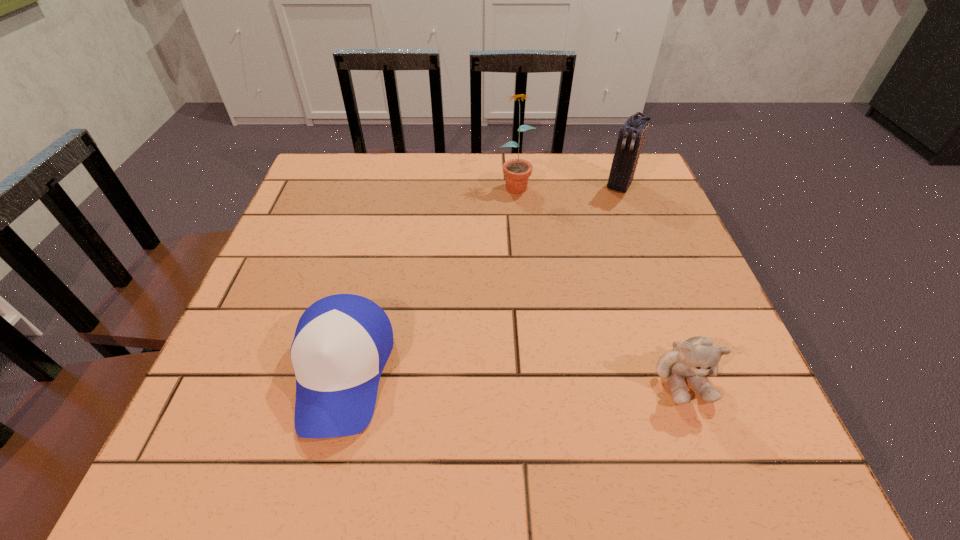
Locate an element on the screen. This screenshot has width=960, height=540. vacant space located 0.070m with the zip open on the second tallest object is located at coordinates (606, 209).

At what (x,y) coordinates should I click in order to perform the action: click on sunflower present at the far edge. Please return your answer as a coordinate pair (x, y). This screenshot has width=960, height=540. Looking at the image, I should click on (517, 171).

The image size is (960, 540). In order to click on clutch bag that is at the far edge in this screenshot , I will do `click(631, 136)`.

Where is `baseball cap at the near edge`? baseball cap at the near edge is located at coordinates (342, 342).

Find the location of a particular element. Image resolution: width=960 pixels, height=540 pixels. teddy bear that is at the near edge is located at coordinates tap(696, 357).

The width and height of the screenshot is (960, 540). Find the location of `object located in the left edge section of the desktop`. object located in the left edge section of the desktop is located at coordinates (342, 342).

Find the location of a particular element. Image resolution: width=960 pixels, height=540 pixels. teddy bear present at the right edge is located at coordinates (696, 357).

What are the coordinates of `clutch bag positioned at the right edge` in the screenshot? It's located at (631, 136).

Image resolution: width=960 pixels, height=540 pixels. Find the location of `object at the near left corner`. object at the near left corner is located at coordinates (342, 342).

At what (x,y) coordinates should I click in order to perform the action: click on object located in the far right corner section of the desktop. Please return your answer as a coordinate pair (x, y). The width and height of the screenshot is (960, 540). Looking at the image, I should click on (631, 136).